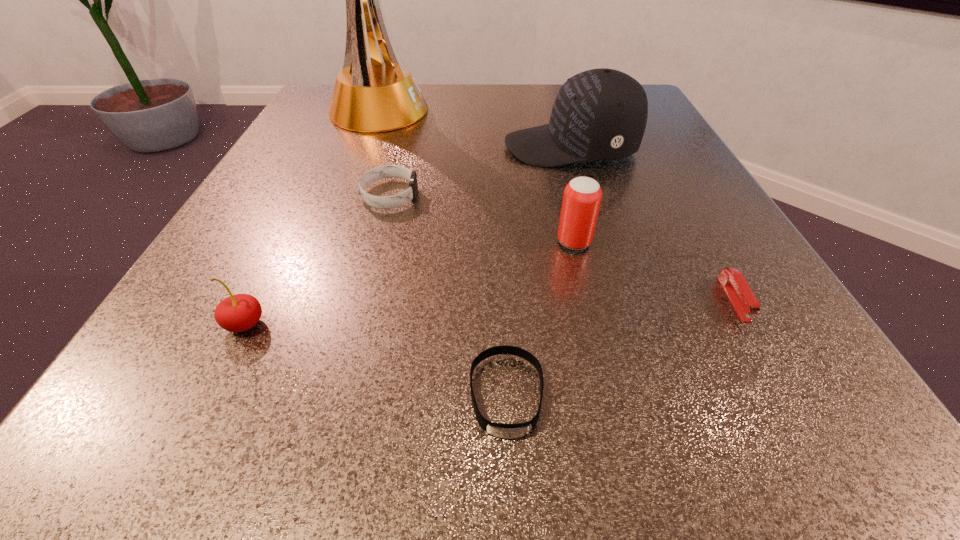
This screenshot has height=540, width=960. I want to click on vacant space located 0.170m on the front-facing side of the trophy, so click(505, 112).

The image size is (960, 540). Identify the location of free space located 0.110m at the front of the baseball cap where the brim is located. (447, 147).

The width and height of the screenshot is (960, 540). In order to click on vacant area situated at the front of the baseball cap where the brim is located in this screenshot , I will do `click(464, 147)`.

You are a GUI agent. You are given a task and a screenshot of the screen. Output one action in this format:
    pyautogui.click(x=<x>, y=<y>)
    Task: Click on the vacant space situated at the front of the baseball cap where the brim is located
    Image resolution: width=960 pixels, height=540 pixels.
    Given the screenshot: What is the action you would take?
    pyautogui.click(x=355, y=147)

Identify the location of free space located on the left of the fourth farthest object. The image size is (960, 540). click(x=475, y=242).

The image size is (960, 540). I want to click on free space located on the right of the cherry, so click(x=331, y=324).

Locate an element on the screen. vacant position located on the outer surface of the taller wristband is located at coordinates (471, 195).

The image size is (960, 540). What are the coordinates of `vacant space positioned 0.120m on the front-facing side of the second shortest object` in the screenshot? It's located at (799, 413).

At what (x,y) coordinates should I click in order to perform the action: click on trophy at the far edge. Please return your answer as a coordinate pair (x, y). This screenshot has height=540, width=960. Looking at the image, I should click on (381, 95).

The width and height of the screenshot is (960, 540). Find the location of `baseball cap at the far edge`. baseball cap at the far edge is located at coordinates click(x=600, y=114).